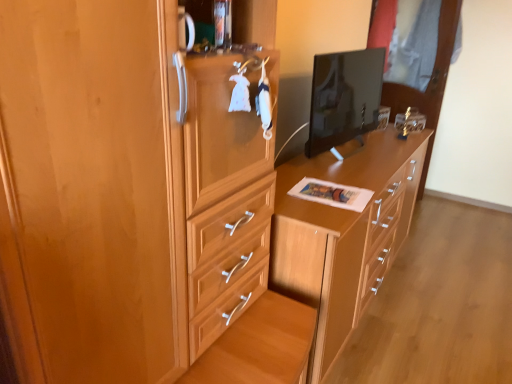
Question: Is wooden chest of drawers at center inside the boundaries of transparent glass door at upper right, or outside?

Choices:
 (A) inside
 (B) outside

Answer: (B)

Question: From the image's perspective, is wooden chest of drawers at center positioned above or below transparent glass door at upper right?

Choices:
 (A) below
 (B) above

Answer: (A)

Question: Which object is the farthest from the transparent glass door at upper right?

Choices:
 (A) matte wood cabinet at center
 (B) matte black monitor at center
 (C) wooden chest of drawers at center

Answer: (A)

Question: Estimate the real-world distances between objects in this image. Which object is closer to the wooden chest of drawers at center?

Choices:
 (A) matte black monitor at center
 (B) matte wood cabinet at center
 (C) transparent glass door at upper right

Answer: (A)